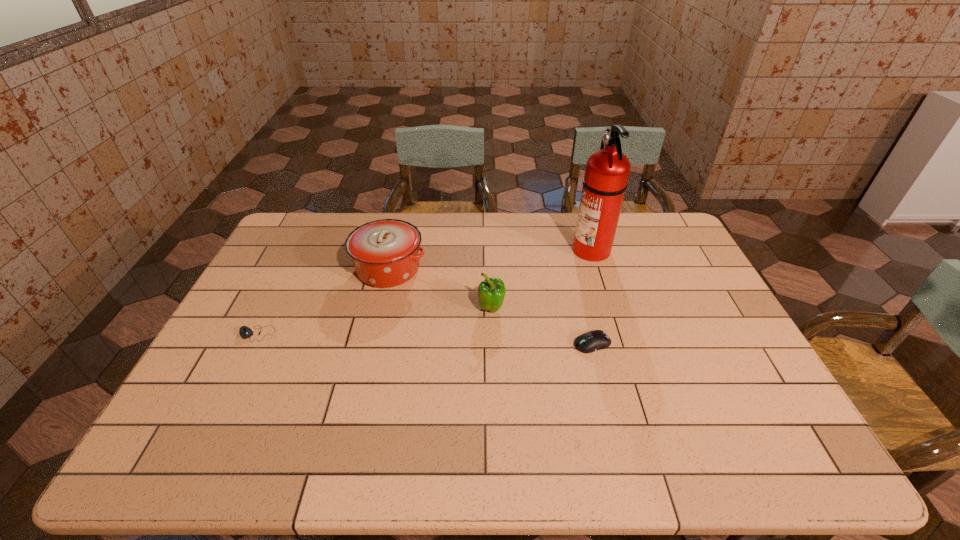
This screenshot has width=960, height=540. I want to click on free region located at the nozzle of the tallest object, so click(510, 249).

Locate an element on the screen. free spot located on the front of the casserole is located at coordinates (380, 305).

You are a GUI agent. You are given a task and a screenshot of the screen. Output one action in this format:
    pyautogui.click(x=<x>, y=<y>)
    Task: Click on the vacant space situated 0.260m on the front of the bell pepper
    This screenshot has width=960, height=540.
    Given the screenshot: What is the action you would take?
    pyautogui.click(x=493, y=393)

This screenshot has width=960, height=540. I want to click on vacant area located on the right of the right computer mouse, so click(726, 343).

The height and width of the screenshot is (540, 960). I want to click on free location located 0.140m on the right of the leftmost object, so click(x=324, y=334).

The image size is (960, 540). Identify the location of fire extinguisher located at the far edge. (607, 171).

The image size is (960, 540). I want to click on casserole that is at the far edge, so click(385, 253).

This screenshot has width=960, height=540. I want to click on object that is at the left edge, so click(x=246, y=332).

This screenshot has height=540, width=960. In the image, there is a desktop. Identify the location of vacant space at the far edge. (469, 238).

Locate an element on the screen. The image size is (960, 540). vacant region at the near edge of the desktop is located at coordinates (553, 449).